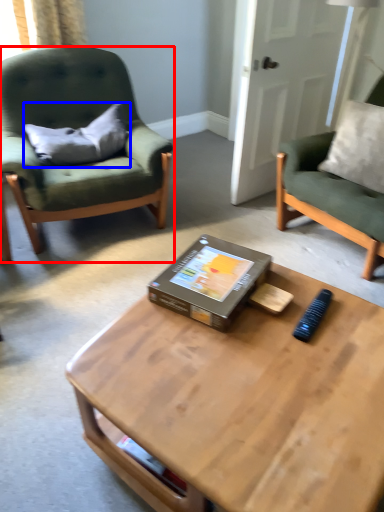
Question: Which point is closer to the camera, chair (highlighted by a red box) or pillow (highlighted by a blue box)?

Choices:
 (A) chair
 (B) pillow

Answer: (A)